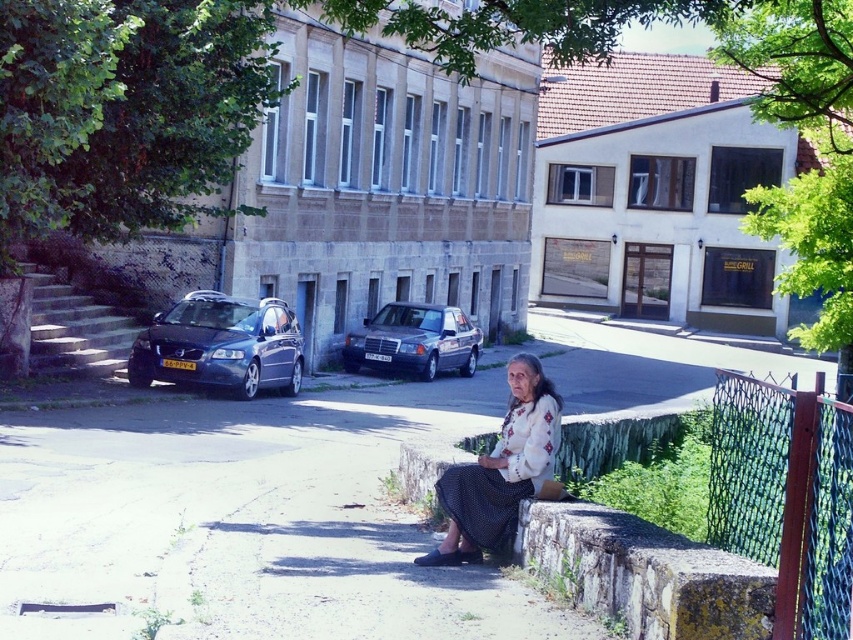
You are a drone operator trying to capture aerial footage of the urban scene. You have two points marked on your map for camera positioning. The first point is at coordinates point (x=711, y=451) and the second at point (x=619, y=592). Which point would you choose to ensure the camera can capture both the woman on the wall and the multi story building in the background without any obstruction?

Point (x=619, y=592) should be chosen because point (x=711, y=451) is behind it, so selecting the forward point will allow the camera to see both the woman on the wall and the multi story building without obstruction.

You are a photographer trying to capture the woman in the scene. You notice the stone at lower right and the white embroidered blouse at center. Which object is closer to the camera? Please explain your reasoning based on their positions.

The stone at lower right is not as tall as the white embroidered blouse at center, which indicates that the white embroidered blouse at center is closer to the camera. In perspective, objects closer to the viewer appear larger, so the blouse being taller suggests it is nearer than the stone.